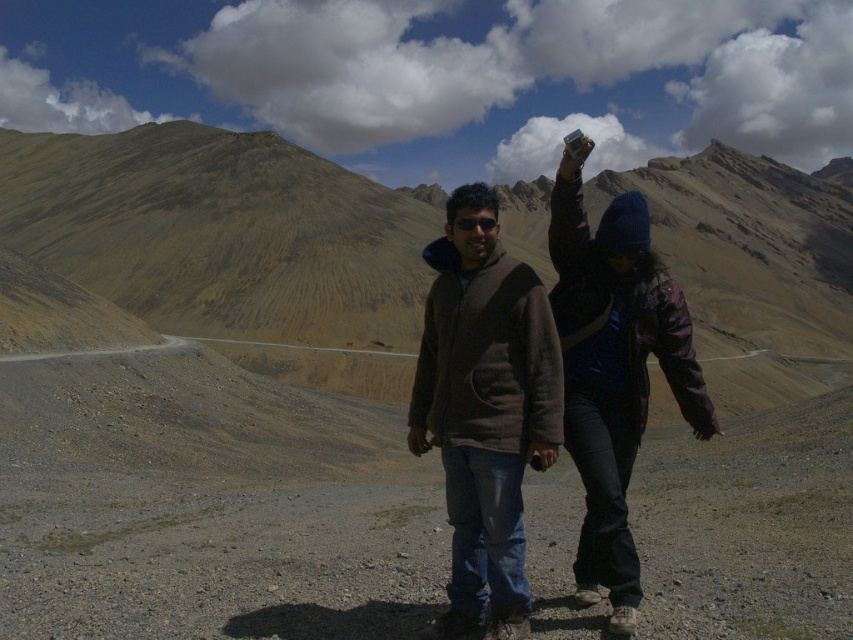
You are a photographer trying to capture the two items in the image. You want to arrange them so that the brown fuzzy jacket at center is to the right of the black matte goggles at center. Is this possible based on their current positions?

The brown fuzzy jacket at center is positioned on the left side of black matte goggles at center, so to arrange them with the jacket to the right of the goggles, you would need to move the jacket to the right side of the goggles.